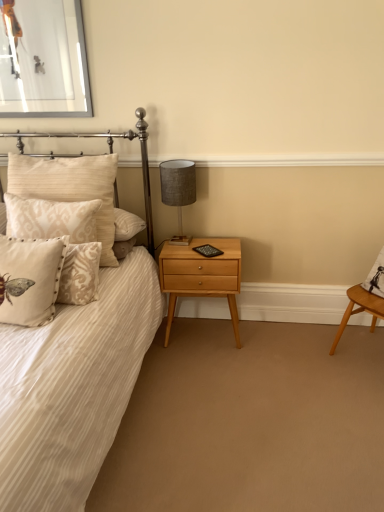
What do you see at coordinates (62, 236) in the screenshot?
I see `beige velvet pillow at left, the 2th pillow when ordered from back to front` at bounding box center [62, 236].

Identify the location of beige textured pillow at left, the 1th pillow from the back. (70, 187).

The width and height of the screenshot is (384, 512). What do you see at coordinates (43, 59) in the screenshot?
I see `metallic silver picture frame at upper left` at bounding box center [43, 59].

What is the approximate height of metallic silver picture frame at upper left?

63.39 centimeters.

You are a GUI agent. You are given a task and a screenshot of the screen. Output one action in this format:
    pyautogui.click(x=<x>, y=<y>)
    Task: Click on the beige damask pillow at left, arranged as the first pillow when viewed from the front
    This screenshot has width=384, height=512.
    Given the screenshot: What is the action you would take?
    pyautogui.click(x=30, y=279)

The height and width of the screenshot is (512, 384). What do you see at coordinates (30, 279) in the screenshot?
I see `beige damask pillow at left, the 3th pillow positioned from the back` at bounding box center [30, 279].

Where is `light wood/texture nightstand at lower center`? The height and width of the screenshot is (512, 384). light wood/texture nightstand at lower center is located at coordinates (201, 275).

Can you confirm if beige damask pillow at left, arranged as the first pillow when viewed from the front, is smaller than white striped fabric bed at left?

Correct, beige damask pillow at left, arranged as the first pillow when viewed from the front, occupies less space than white striped fabric bed at left.

In the scene shown: Considering the sizes of beige damask pillow at left, arranged as the first pillow when viewed from the front, and white striped fabric bed at left in the image, is beige damask pillow at left, arranged as the first pillow when viewed from the front, wider or thinner than white striped fabric bed at left?

Considering their sizes, beige damask pillow at left, arranged as the first pillow when viewed from the front, looks slimmer than white striped fabric bed at left.

From a real-world perspective, who is located lower, beige damask pillow at left, arranged as the first pillow when viewed from the front, or white striped fabric bed at left?

In real-world perspective, white striped fabric bed at left is lower.

Is beige damask pillow at left, the 3th pillow positioned from the back, further to the viewer compared to white striped fabric bed at left?

Yes, beige damask pillow at left, the 3th pillow positioned from the back, is behind white striped fabric bed at left.

Is textured gray lampshade at upper right positioned with its back to beige textured pillow at left, arranged as the 3th pillow when viewed from the front?

No.

Considering the positions of objects textured gray lampshade at upper right and beige textured pillow at left, arranged as the 3th pillow when viewed from the front, in the image provided, who is more to the left, textured gray lampshade at upper right or beige textured pillow at left, arranged as the 3th pillow when viewed from the front,?

beige textured pillow at left, arranged as the 3th pillow when viewed from the front.

From the image's perspective, would you say textured gray lampshade at upper right is shown under beige textured pillow at left, the 1th pillow from the back?

Incorrect, from the image's perspective, textured gray lampshade at upper right is higher than beige textured pillow at left, the 1th pillow from the back.

From a real-world perspective, is light wood/texture nightstand at lower center over beige damask pillow at left, arranged as the first pillow when viewed from the front?

No, from a real-world perspective, light wood/texture nightstand at lower center is not on top of beige damask pillow at left, arranged as the first pillow when viewed from the front.

Between light wood/texture nightstand at lower center and beige damask pillow at left, arranged as the first pillow when viewed from the front, which one has smaller size?

beige damask pillow at left, arranged as the first pillow when viewed from the front, is smaller.

Is beige damask pillow at left, the 3th pillow positioned from the back, inside light wood/texture nightstand at lower center?

No, beige damask pillow at left, the 3th pillow positioned from the back, is not surrounded by light wood/texture nightstand at lower center.

Which point is more distant from viewer, (x=13, y=187) or (x=0, y=68)?

Positioned behind is point (x=0, y=68).

Is metallic silver picture frame at upper left inside beige textured pillow at left, the 1th pillow from the back?

No.

Considering the relative positions of beige textured pillow at left, the 1th pillow from the back, and metallic silver picture frame at upper left in the image provided, is beige textured pillow at left, the 1th pillow from the back, to the right of metallic silver picture frame at upper left from the viewer's perspective?

Yes.

Which object is further away from the camera, beige textured pillow at left, the 1th pillow from the back, or metallic silver picture frame at upper left?

metallic silver picture frame at upper left is further from the camera.

From the image's perspective, between beige textured pillow at left, arranged as the 3th pillow when viewed from the front, and beige damask pillow at left, the 3th pillow positioned from the back, who is located below?

beige damask pillow at left, the 3th pillow positioned from the back, is shown below in the image.

Are beige textured pillow at left, arranged as the 3th pillow when viewed from the front, and beige damask pillow at left, arranged as the first pillow when viewed from the front, located far from each other?

That's not correct — beige textured pillow at left, arranged as the 3th pillow when viewed from the front, is a little close to beige damask pillow at left, arranged as the first pillow when viewed from the front.

Which object is further away from the camera, beige textured pillow at left, arranged as the 3th pillow when viewed from the front, or beige damask pillow at left, arranged as the first pillow when viewed from the front?

Positioned behind is beige textured pillow at left, arranged as the 3th pillow when viewed from the front.

Considering the sizes of objects beige textured pillow at left, arranged as the 3th pillow when viewed from the front, and beige damask pillow at left, the 3th pillow positioned from the back, in the image provided, who is bigger, beige textured pillow at left, arranged as the 3th pillow when viewed from the front, or beige damask pillow at left, the 3th pillow positioned from the back,?

Bigger between the two is beige textured pillow at left, arranged as the 3th pillow when viewed from the front.

Who is bigger, beige velvet pillow at left, the 2th pillow when ordered from back to front, or white striped fabric bed at left?

white striped fabric bed at left.

Is beige velvet pillow at left, which is the 2th pillow in front-to-back order, to the left of white striped fabric bed at left from the viewer's perspective?

No, beige velvet pillow at left, which is the 2th pillow in front-to-back order, is not to the left of white striped fabric bed at left.

Considering the sizes of objects beige velvet pillow at left, which is the 2th pillow in front-to-back order, and white striped fabric bed at left in the image provided, who is thinner, beige velvet pillow at left, which is the 2th pillow in front-to-back order, or white striped fabric bed at left?

With smaller width is beige velvet pillow at left, which is the 2th pillow in front-to-back order.

From the picture: Choose the correct answer: Is metallic silver picture frame at upper left inside beige velvet pillow at left, the 2th pillow when ordered from back to front, or outside it?

The correct answer is: outside.

From the picture: From a real-world perspective, is metallic silver picture frame at upper left physically located above or below beige velvet pillow at left, the 2th pillow when ordered from back to front?

metallic silver picture frame at upper left is situated higher than beige velvet pillow at left, the 2th pillow when ordered from back to front, in the real world.

Between metallic silver picture frame at upper left and beige velvet pillow at left, which is the 2th pillow in front-to-back order, which one has larger width?

beige velvet pillow at left, which is the 2th pillow in front-to-back order, is wider.

Is metallic silver picture frame at upper left shorter than beige velvet pillow at left, the 2th pillow when ordered from back to front?

In fact, metallic silver picture frame at upper left may be taller than beige velvet pillow at left, the 2th pillow when ordered from back to front.

Find the location of `bed located below the beige damask pillow at left, the 3th pillow positioned from the back (from the image's perspective)`. bed located below the beige damask pillow at left, the 3th pillow positioned from the back (from the image's perspective) is located at coordinates (73, 387).

Identify the location of table lamp that appears below the beige textured pillow at left, the 1th pillow from the back (from a real-world perspective). The height and width of the screenshot is (512, 384). (178, 190).

When comparing their distances from beige textured pillow at left, arranged as the 3th pillow when viewed from the front, does textured gray lampshade at upper right or metallic silver picture frame at upper left seem closer?

Among the two, textured gray lampshade at upper right is located nearer to beige textured pillow at left, arranged as the 3th pillow when viewed from the front.

Estimate the real-world distances between objects in this image. Which object is further from textured gray lampshade at upper right, beige damask pillow at left, arranged as the first pillow when viewed from the front, or light wood/texture nightstand at lower center?

beige damask pillow at left, arranged as the first pillow when viewed from the front, lies further to textured gray lampshade at upper right than the other object.

Looking at the image, which one is located further to beige textured pillow at left, the 1th pillow from the back, beige damask pillow at left, arranged as the first pillow when viewed from the front, or textured gray lampshade at upper right?

The object further to beige textured pillow at left, the 1th pillow from the back, is textured gray lampshade at upper right.

Considering their positions, is beige velvet pillow at left, which is the 2th pillow in front-to-back order, positioned closer to metallic silver picture frame at upper left than beige damask pillow at left, the 3th pillow positioned from the back?

Based on the image, beige velvet pillow at left, which is the 2th pillow in front-to-back order, appears to be nearer to metallic silver picture frame at upper left.

Estimate the real-world distances between objects in this image. Which object is closer to metallic silver picture frame at upper left, white striped fabric bed at left or beige textured pillow at left, the 1th pillow from the back?

beige textured pillow at left, the 1th pillow from the back, lies closer to metallic silver picture frame at upper left than the other object.

Based on their spatial positions, is beige damask pillow at left, the 3th pillow positioned from the back, or white striped fabric bed at left further from light wood/texture nightstand at lower center?

Based on the image, beige damask pillow at left, the 3th pillow positioned from the back, appears to be further to light wood/texture nightstand at lower center.

Which object lies nearer to the anchor point white striped fabric bed at left, beige velvet pillow at left, the 2th pillow when ordered from back to front, or metallic silver picture frame at upper left?

beige velvet pillow at left, the 2th pillow when ordered from back to front, is positioned closer to the anchor white striped fabric bed at left.

Which object lies further to the anchor point beige damask pillow at left, the 3th pillow positioned from the back, metallic silver picture frame at upper left or textured gray lampshade at upper right?

Among the two, metallic silver picture frame at upper left is located further to beige damask pillow at left, the 3th pillow positioned from the back.

Identify the location of pillow between beige damask pillow at left, the 3th pillow positioned from the back, and beige textured pillow at left, arranged as the 3th pillow when viewed from the front, in the front-back direction. This screenshot has width=384, height=512. (62, 236).

Locate an element on the screen. table lamp between metallic silver picture frame at upper left and beige damask pillow at left, the 3th pillow positioned from the back, from top to bottom is located at coordinates (178, 190).

Locate an element on the screen. pillow situated between beige textured pillow at left, arranged as the 3th pillow when viewed from the front, and light wood/texture nightstand at lower center from left to right is located at coordinates (62, 236).

Find the location of a particular element. table lamp located between white striped fabric bed at left and light wood/texture nightstand at lower center in the depth direction is located at coordinates (178, 190).